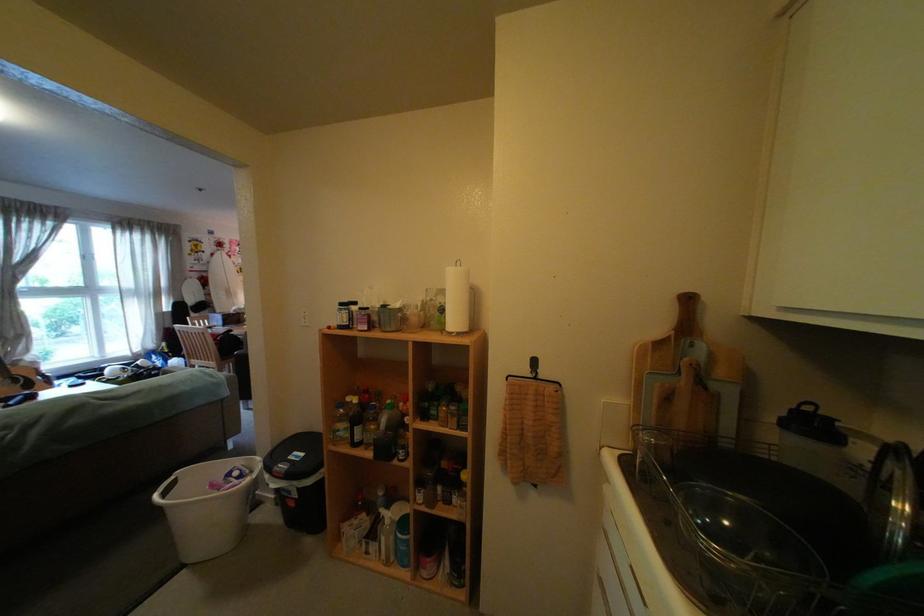
Describe the element at coordinates (71, 424) in the screenshot. I see `a sofa sitting surface` at that location.